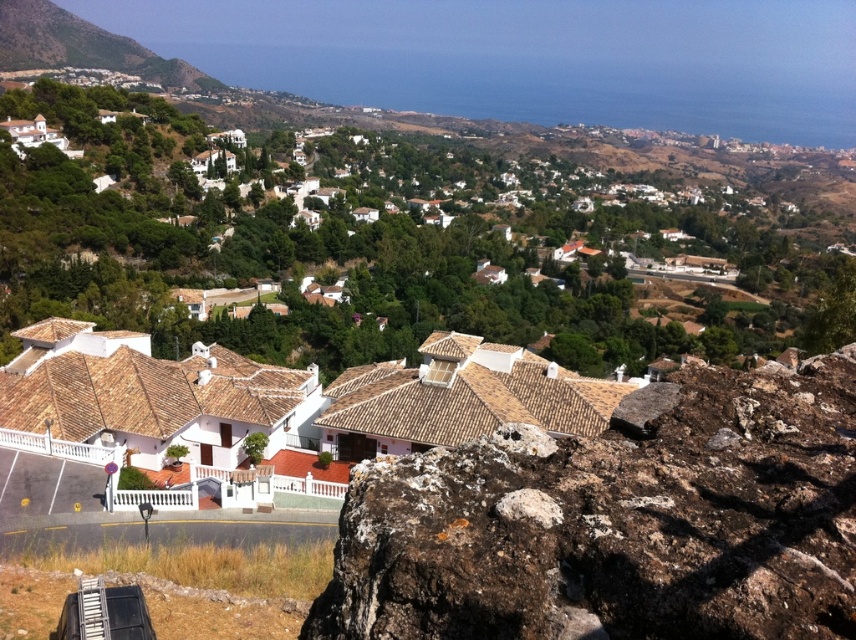
Which of these two, brown rough rock at lower right or white tile roof houses at lower left, stands taller?

With more height is white tile roof houses at lower left.

Is brown rough rock at lower right thinner than white tile roof houses at lower left?

Yes, brown rough rock at lower right is thinner than white tile roof houses at lower left.

Does point (569, 480) come behind point (103, 333)?

No, (569, 480) is closer to viewer.

The image size is (856, 640). In order to click on brown rough rock at lower right in this screenshot , I will do (x=617, y=522).

Which of these two, brown rough rock at lower right or green grassy hillside at upper left, stands taller?

green grassy hillside at upper left

At what (x,y) coordinates should I click in order to perform the action: click on brown rough rock at lower right. Please return your answer as a coordinate pair (x, y). The width and height of the screenshot is (856, 640). Looking at the image, I should click on (617, 522).

Between point (722, 474) and point (69, 64), which one is positioned in front?

Point (722, 474) is more forward.

This screenshot has height=640, width=856. In order to click on brown rough rock at lower right in this screenshot , I will do `click(617, 522)`.

From the picture: Which of these two, white tile roof houses at lower left or green grassy hillside at upper left, stands shorter?

Standing shorter between the two is white tile roof houses at lower left.

Is point (217, 372) positioned after point (161, 74)?

That is False.

This screenshot has height=640, width=856. In order to click on white tile roof houses at lower left in this screenshot , I will do `click(278, 397)`.